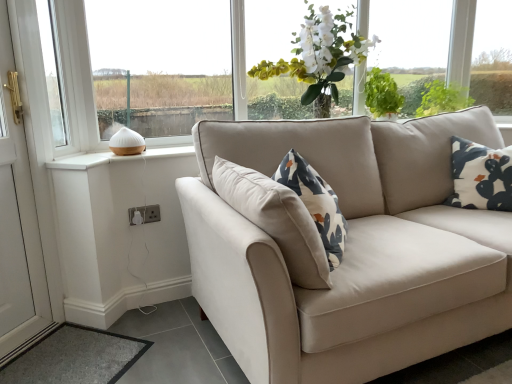
Question: Is white silk flowers at upper center to the left of white glossy door at left from the viewer's perspective?

Choices:
 (A) yes
 (B) no

Answer: (B)

Question: Is white silk flowers at upper center to the right of white glossy door at left from the viewer's perspective?

Choices:
 (A) no
 (B) yes

Answer: (B)

Question: Is white silk flowers at upper center turned away from white glossy door at left?

Choices:
 (A) no
 (B) yes

Answer: (A)

Question: Is white silk flowers at upper center further to the viewer compared to white glossy door at left?

Choices:
 (A) yes
 (B) no

Answer: (A)

Question: Is white silk flowers at upper center surrounding white glossy door at left?

Choices:
 (A) yes
 (B) no

Answer: (B)

Question: Considering the relative sizes of white silk flowers at upper center and white glossy door at left in the image provided, is white silk flowers at upper center taller than white glossy door at left?

Choices:
 (A) no
 (B) yes

Answer: (A)

Question: Is white plastic socket at lower left surrounded by white glossy door at left?

Choices:
 (A) yes
 (B) no

Answer: (B)

Question: Is white glossy door at left next to white plastic socket at lower left and touching it?

Choices:
 (A) yes
 (B) no

Answer: (B)

Question: Is white glossy door at left bigger than white plastic socket at lower left?

Choices:
 (A) no
 (B) yes

Answer: (B)

Question: Does white glossy door at left appear on the right side of white plastic socket at lower left?

Choices:
 (A) yes
 (B) no

Answer: (B)

Question: Considering the relative sizes of white glossy door at left and white plastic socket at lower left in the image provided, is white glossy door at left wider than white plastic socket at lower left?

Choices:
 (A) yes
 (B) no

Answer: (A)

Question: Can we say white glossy door at left lies outside white plastic socket at lower left?

Choices:
 (A) no
 (B) yes

Answer: (B)

Question: Is gray carpet at lower left to the right of white plastic window at upper left, which is the first window in left-to-right order, from the viewer's perspective?

Choices:
 (A) no
 (B) yes

Answer: (B)